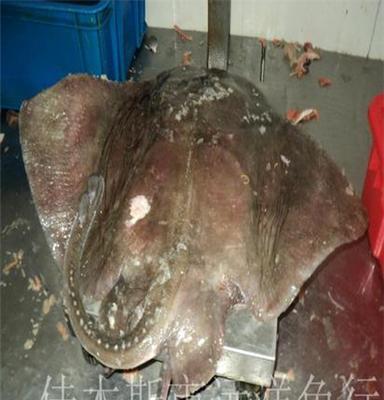
Identify the location of cracks in floor. (48, 305).